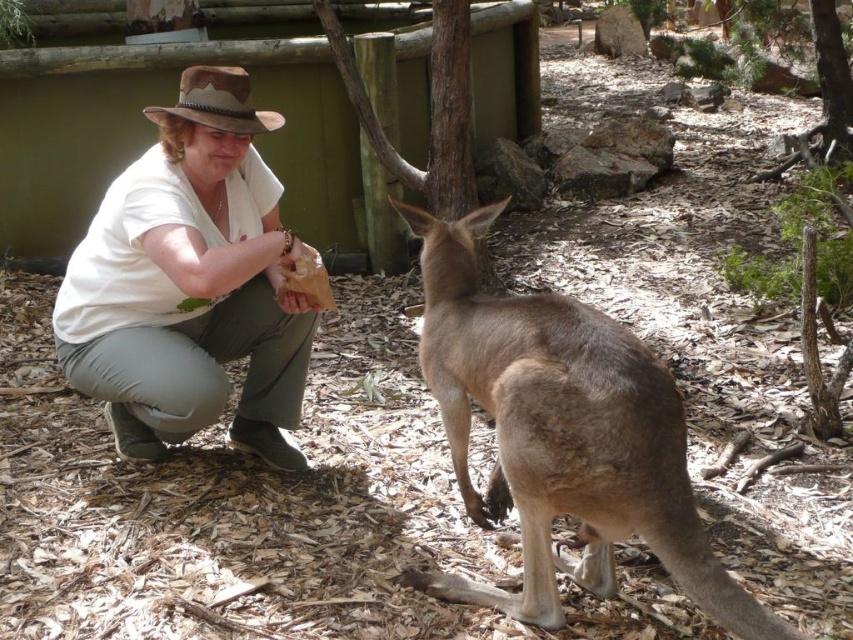
Who is positioned more to the right, brown furry kangaroo at center or white cotton shirt at center?

Positioned to the right is brown furry kangaroo at center.

Image resolution: width=853 pixels, height=640 pixels. What do you see at coordinates (561, 435) in the screenshot? I see `brown furry kangaroo at center` at bounding box center [561, 435].

Find the location of a particular element. This screenshot has width=853, height=640. brown furry kangaroo at center is located at coordinates (561, 435).